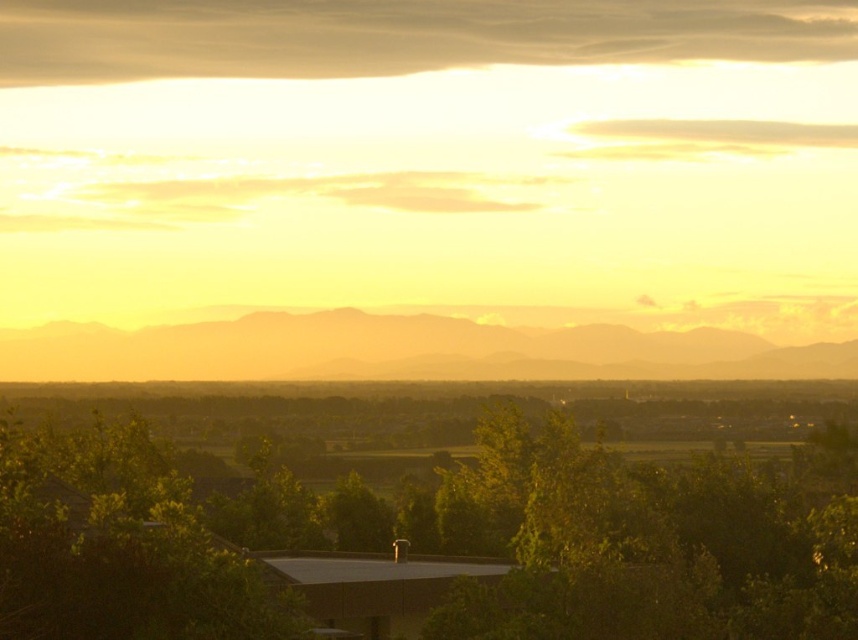
Does green leafy tree at center have a lesser width compared to dull orange mountain at center?

Correct, green leafy tree at center's width is less than dull orange mountain at center's.

Is green leafy tree at center above dull orange mountain at center?

No, green leafy tree at center is not above dull orange mountain at center.

Locate an element on the screen. green leafy tree at center is located at coordinates (434, 544).

Find the location of a particular element. green leafy tree at center is located at coordinates (434, 544).